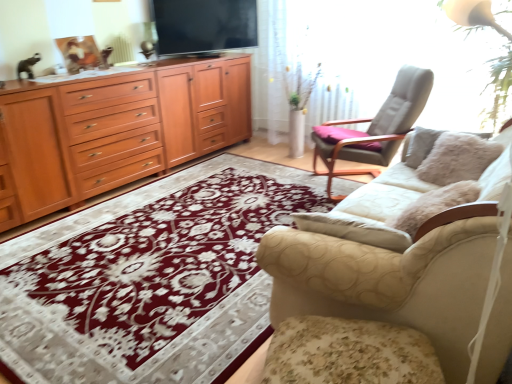
Question: Does beige fabric couch at right lie in front of flat screen tv at upper center?

Choices:
 (A) no
 (B) yes

Answer: (B)

Question: Could you tell me if beige fabric couch at right is facing flat screen tv at upper center?

Choices:
 (A) yes
 (B) no

Answer: (A)

Question: From a real-world perspective, is beige fabric couch at right over flat screen tv at upper center?

Choices:
 (A) yes
 (B) no

Answer: (B)

Question: Would you say beige fabric couch at right contains flat screen tv at upper center?

Choices:
 (A) yes
 (B) no

Answer: (B)

Question: Is beige fabric couch at right thinner than flat screen tv at upper center?

Choices:
 (A) no
 (B) yes

Answer: (A)

Question: Does beige fabric couch at right have a greater height compared to flat screen tv at upper center?

Choices:
 (A) no
 (B) yes

Answer: (B)

Question: Does floral fabric footrest at lower right lie in front of light gray fabric chair at upper right?

Choices:
 (A) no
 (B) yes

Answer: (B)

Question: From a real-world perspective, is floral fabric footrest at lower right on light gray fabric chair at upper right?

Choices:
 (A) no
 (B) yes

Answer: (A)

Question: Is floral fabric footrest at lower right at the right side of light gray fabric chair at upper right?

Choices:
 (A) yes
 (B) no

Answer: (B)

Question: Does floral fabric footrest at lower right have a smaller size compared to light gray fabric chair at upper right?

Choices:
 (A) yes
 (B) no

Answer: (A)

Question: Could you tell me if floral fabric footrest at lower right is facing light gray fabric chair at upper right?

Choices:
 (A) yes
 (B) no

Answer: (B)

Question: Is floral fabric footrest at lower right turned away from light gray fabric chair at upper right?

Choices:
 (A) yes
 (B) no

Answer: (B)

Question: Is wooden cabinet at left thinner than beige fabric couch at right?

Choices:
 (A) no
 (B) yes

Answer: (B)